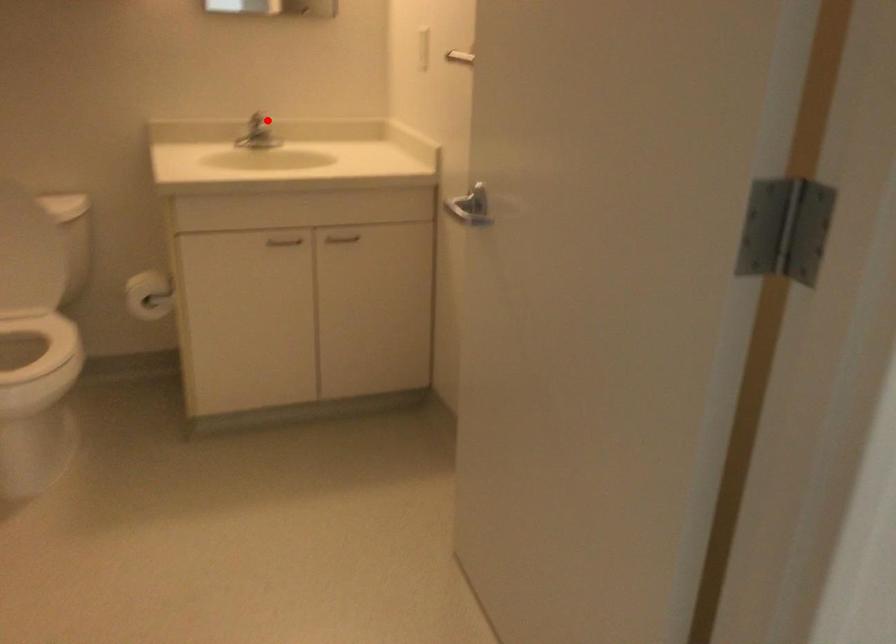
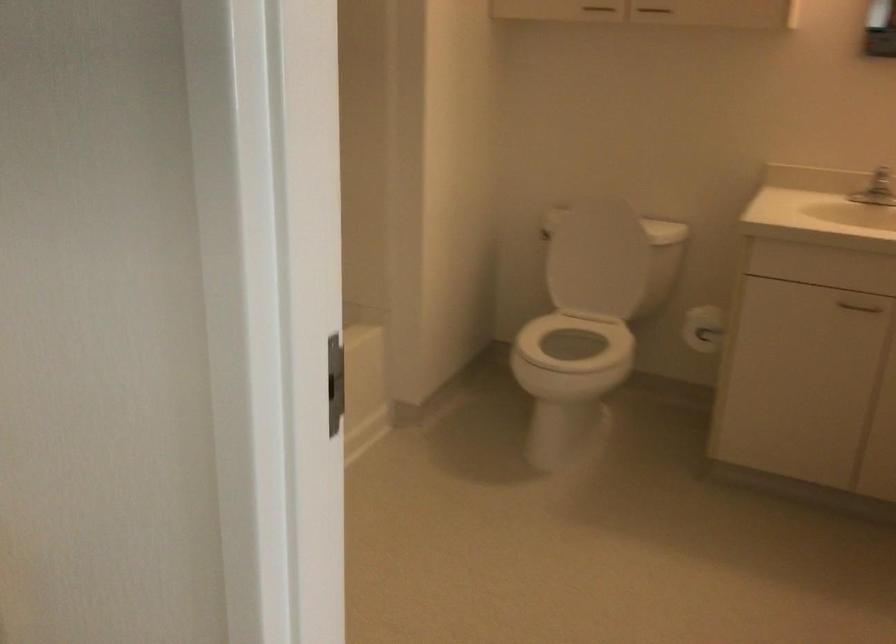
Locate, in the second image, the point that corresponds to the highlighted location in the first image.

(881, 182)